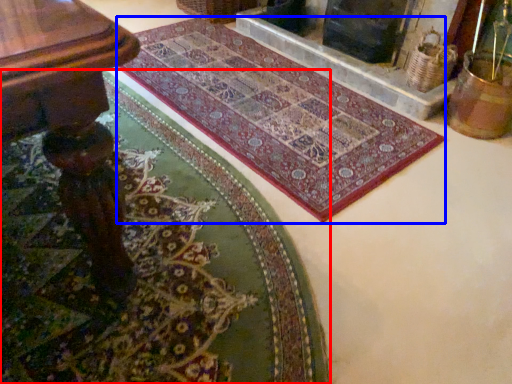
Question: Which of the following is the closest to the observer, mat (highlighted by a red box) or mat (highlighted by a blue box)?

Choices:
 (A) mat
 (B) mat

Answer: (A)